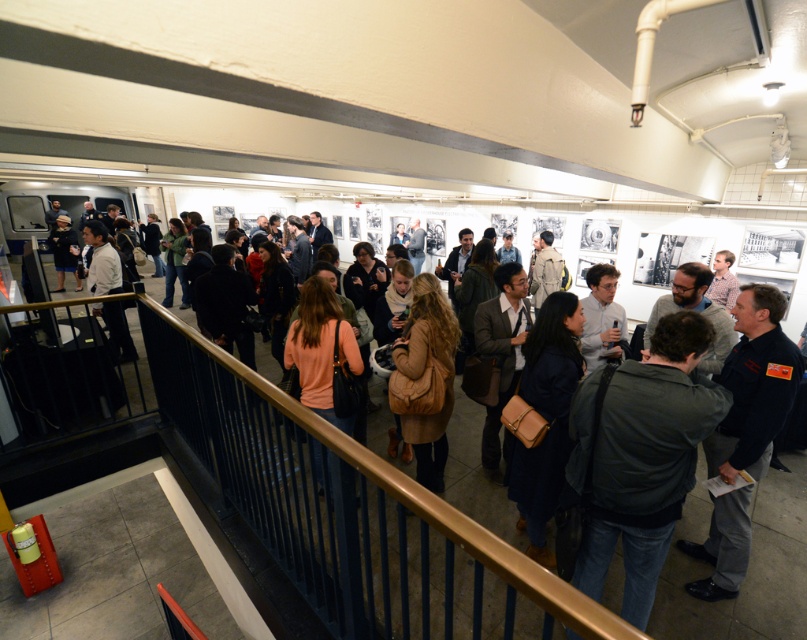
Question: Does dark green jacket at center have a smaller size compared to matte black jacket at center?

Choices:
 (A) no
 (B) yes

Answer: (B)

Question: Which of the following is the farthest from the observer?

Choices:
 (A) black metal railing at center
 (B) light gray shirt at center
 (C) matte black jacket at center

Answer: (C)

Question: Among these points, which one is farthest from the camera?

Choices:
 (A) (724, 372)
 (B) (240, 544)
 (C) (604, 346)
 (D) (615, 522)

Answer: (C)

Question: Which of the following is the farthest from the observer?

Choices:
 (A) (575, 492)
 (B) (768, 314)
 (C) (599, 316)
 (D) (228, 481)

Answer: (C)

Question: Is black uniform at center further to camera compared to light gray shirt at center?

Choices:
 (A) no
 (B) yes

Answer: (A)

Question: Can you confirm if black metal railing at center is wider than matte black jacket at center?

Choices:
 (A) yes
 (B) no

Answer: (A)